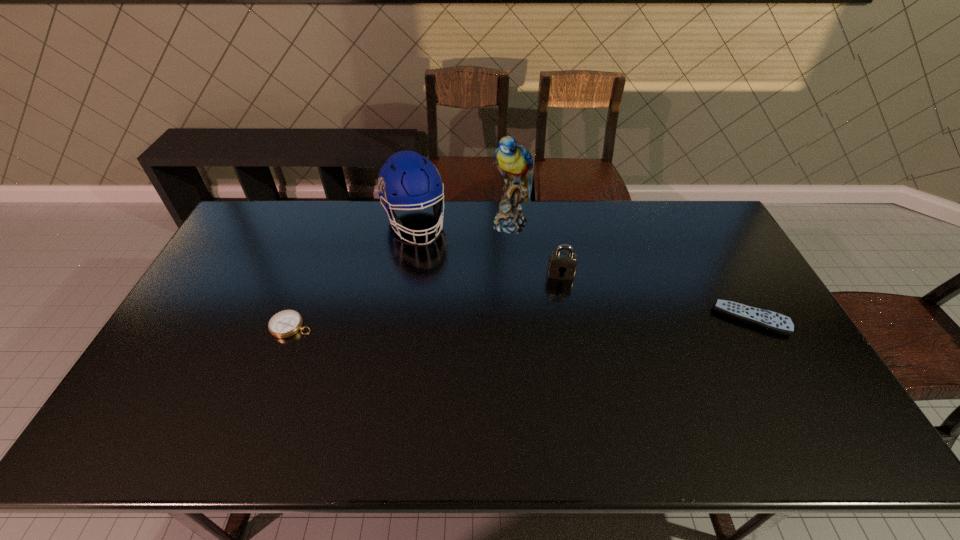
You are a GUI agent. You are given a task and a screenshot of the screen. Output one action in this format:
    pyautogui.click(x=<x>, y=<y>)
    Task: Click on the football helmet situated at the far edge
    
    Given the screenshot: What is the action you would take?
    pyautogui.click(x=409, y=180)

Locate an element on the screen. Image resolution: width=960 pixels, height=540 pixels. object that is at the right edge is located at coordinates (765, 319).

The height and width of the screenshot is (540, 960). In the image, there is a desktop. Find the location of `vacant space at the far edge`. vacant space at the far edge is located at coordinates (596, 224).

I want to click on vacant space at the near edge, so click(581, 398).

You are a GUI agent. You are given a task and a screenshot of the screen. Output one action in this format:
    pyautogui.click(x=<x>, y=<y>)
    Task: Click on the vacant area at the right edge
    The width and height of the screenshot is (960, 540).
    Given the screenshot: What is the action you would take?
    pyautogui.click(x=780, y=364)

Find the location of a particular element. Image resolution: width=960 pixels, height=540 pixels. vacant region at the near right corner of the desktop is located at coordinates (796, 387).

This screenshot has height=540, width=960. In order to click on free spot between the third object from right to left and the fourth shortest object in this screenshot , I will do `click(463, 223)`.

At what (x,y) coordinates should I click in order to perform the action: click on vacant space that's between the remote control and the third farthest object. Please return your answer as a coordinate pair (x, y). Image resolution: width=960 pixels, height=540 pixels. Looking at the image, I should click on (656, 296).

Identify the location of vacant area that lies between the tallest object and the remote control. Image resolution: width=960 pixels, height=540 pixels. (631, 271).

Where is `vacant point located between the third tallest object and the football helmet`? This screenshot has height=540, width=960. vacant point located between the third tallest object and the football helmet is located at coordinates (488, 248).